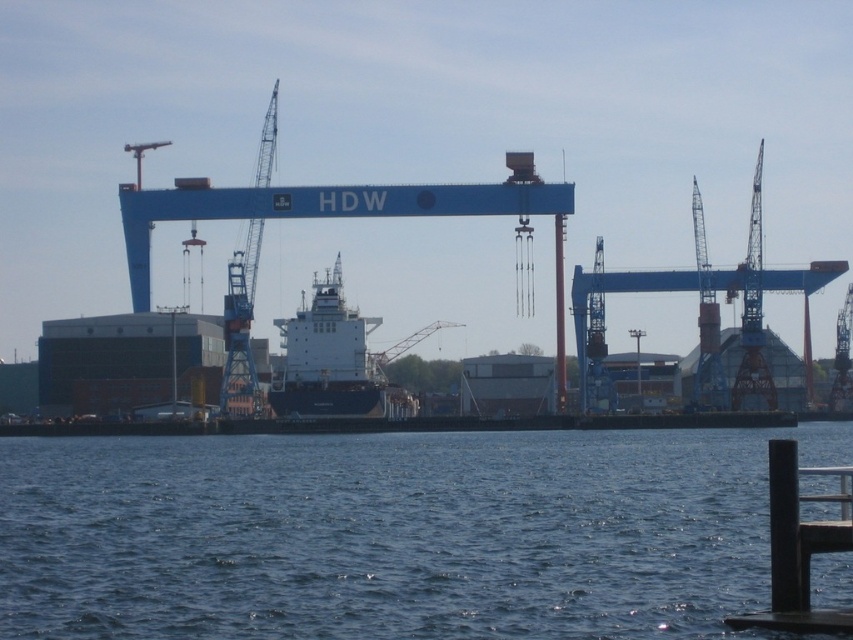
Which is more to the right, blue water at lower center or white matte ship at center?

From the viewer's perspective, blue water at lower center appears more on the right side.

Is blue water at lower center shorter than white matte ship at center?

Yes, blue water at lower center is shorter than white matte ship at center.

What do you see at coordinates (392, 532) in the screenshot?
I see `blue water at lower center` at bounding box center [392, 532].

Image resolution: width=853 pixels, height=640 pixels. In order to click on blue water at lower center in this screenshot , I will do `click(392, 532)`.

Does white matte ship at center come behind black metal dock at lower right?

Yes.

Who is lower down, white matte ship at center or black metal dock at lower right?

Positioned lower is black metal dock at lower right.

Is point (334, 284) farther from viewer compared to point (782, 536)?

Yes, point (334, 284) is farther from viewer.

At what (x,y) coordinates should I click in order to perform the action: click on white matte ship at center. Please return your answer as a coordinate pair (x, y). Looking at the image, I should click on (332, 362).

Is point (368, 317) positioned behind point (367, 362)?

Yes, it is behind point (367, 362).

Is point (315, 298) less distant than point (402, 344)?

That is True.

At what (x,y) coordinates should I click in order to perform the action: click on white matte ship at center. Please return your answer as a coordinate pair (x, y). Looking at the image, I should click on (332, 362).